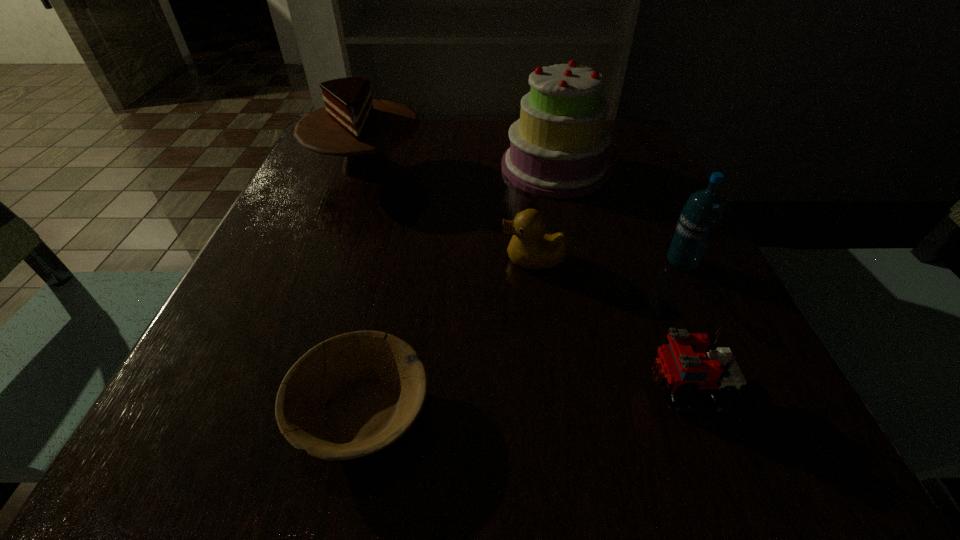
The height and width of the screenshot is (540, 960). Identify the location of vacant space situated 0.340m on the face of the duckling. [303, 260].

Identify the location of vacant space positioned on the face of the duckling. (414, 260).

At what (x,y) coordinates should I click in order to perform the action: click on vacant space situated 0.370m on the face of the duckling. Please return your answer as a coordinate pair (x, y). This screenshot has height=540, width=960. Looking at the image, I should click on (286, 260).

Where is `vacant region located 0.170m on the front-facing side of the Lego`? vacant region located 0.170m on the front-facing side of the Lego is located at coordinates (520, 387).

Where is `vacant space located 0.150m on the front-facing side of the Lego`? The image size is (960, 540). vacant space located 0.150m on the front-facing side of the Lego is located at coordinates (536, 387).

You are a GUI agent. You are given a task and a screenshot of the screen. Output one action in this format:
    pyautogui.click(x=<x>, y=<y>)
    Task: Click on the free space located on the front-facing side of the Lego
    Image resolution: width=960 pixels, height=540 pixels.
    Given the screenshot: What is the action you would take?
    pyautogui.click(x=551, y=387)

Locate an element on the screen. free space located 0.310m on the right of the bowl is located at coordinates (677, 410).

Find the location of a particular element. The width and height of the screenshot is (960, 540). Lego present at the near edge is located at coordinates (690, 362).

I want to click on bowl that is at the near edge, so click(x=373, y=385).

You are a GUI agent. You are given a task and a screenshot of the screen. Output one action in this format:
    pyautogui.click(x=<x>, y=<y>)
    Task: Click on the cake at the left edge
    
    Given the screenshot: What is the action you would take?
    pyautogui.click(x=351, y=124)